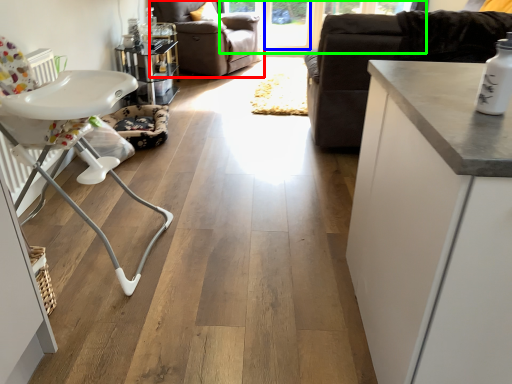
Question: Estimate the real-world distances between objects in this image. Which object is farther from chair (highlighted by a red box), window screen (highlighted by a blue box) or window screen (highlighted by a green box)?

Choices:
 (A) window screen
 (B) window screen

Answer: (A)